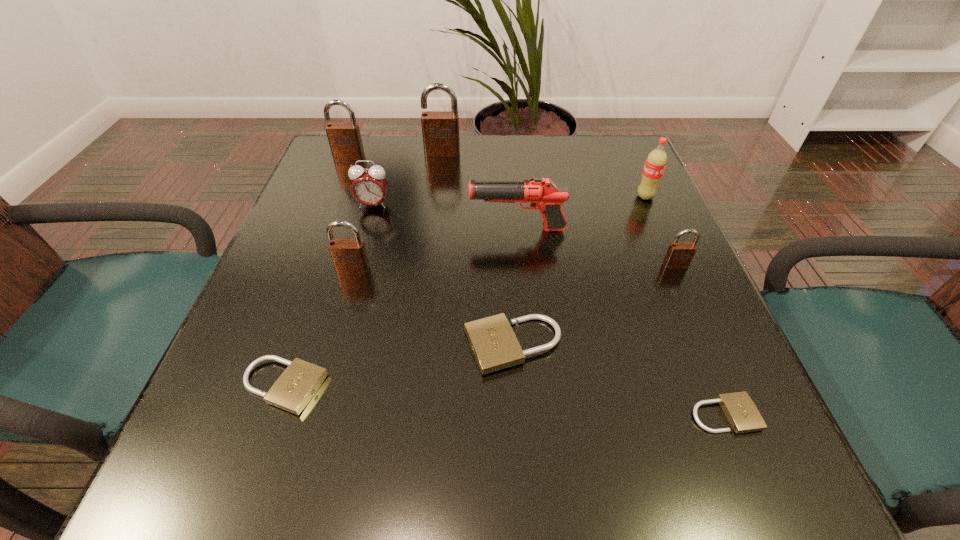
Find the location of a particular element. The height and width of the screenshot is (540, 960). the rightmost brown padlock is located at coordinates pos(679,255).

Locate an element on the screen. The width and height of the screenshot is (960, 540). the smallest brown padlock is located at coordinates (679, 255).

In order to click on the biggest beige padlock in this screenshot , I will do `click(494, 344)`.

The image size is (960, 540). Identify the location of the third padlock from right to left. (494, 344).

Locate an element on the screen. the second shortest padlock is located at coordinates (292, 391).

This screenshot has width=960, height=540. I want to click on the ninth tallest object, so click(x=292, y=391).

The height and width of the screenshot is (540, 960). What are the coordinates of `the shortest object` in the screenshot? It's located at (742, 414).

At what (x,y) coordinates should I click in order to perform the action: click on the shortest padlock. Please return your answer as a coordinate pair (x, y). The width and height of the screenshot is (960, 540). Looking at the image, I should click on (742, 414).

Locate an element on the screen. This screenshot has width=960, height=540. blank area located 0.380m on the front-facing side of the biggest brown padlock is located at coordinates (430, 261).

Where is `free space located on the front-facing side of the third smallest brown padlock`? The width and height of the screenshot is (960, 540). free space located on the front-facing side of the third smallest brown padlock is located at coordinates (325, 218).